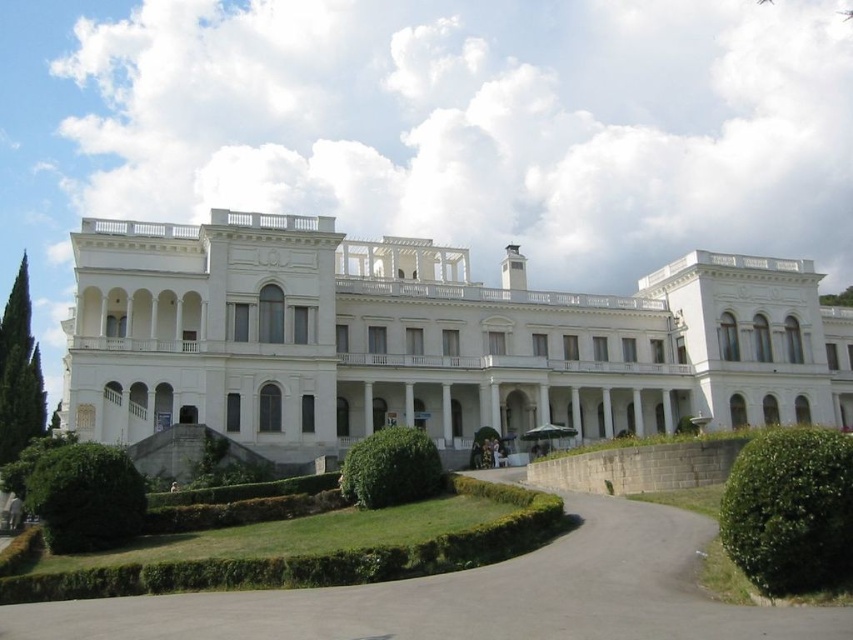
Looking at this image, who is positioned more to the left, gray asphalt driveway at lower center or green leafy hedge at lower right?

gray asphalt driveway at lower center

Which of these two, gray asphalt driveway at lower center or green leafy hedge at lower right, stands taller?

Result: green leafy hedge at lower right

Which is behind, point (778, 614) or point (746, 483)?

The point (746, 483) is more distant.

You are a GUI agent. You are given a task and a screenshot of the screen. Output one action in this format:
    pyautogui.click(x=<x>, y=<y>)
    Task: Click on the gray asphalt driveway at lower center
    This screenshot has width=853, height=640.
    Given the screenshot: What is the action you would take?
    pyautogui.click(x=473, y=596)

The height and width of the screenshot is (640, 853). Describe the element at coordinates (790, 509) in the screenshot. I see `green leafy hedge at lower right` at that location.

Is green leafy hedge at lower right taller than green leafy hedge at lower left?

Indeed, green leafy hedge at lower right has a greater height compared to green leafy hedge at lower left.

Find the location of a particular element. The width and height of the screenshot is (853, 640). green leafy hedge at lower right is located at coordinates (790, 509).

Between white stone building at center and green leafy hedge at lower right, which one has more height?

Standing taller between the two is white stone building at center.

Can you confirm if white stone building at center is taller than green leafy hedge at lower right?

Correct, white stone building at center is much taller as green leafy hedge at lower right.

Find the location of a particular element. white stone building at center is located at coordinates (426, 340).